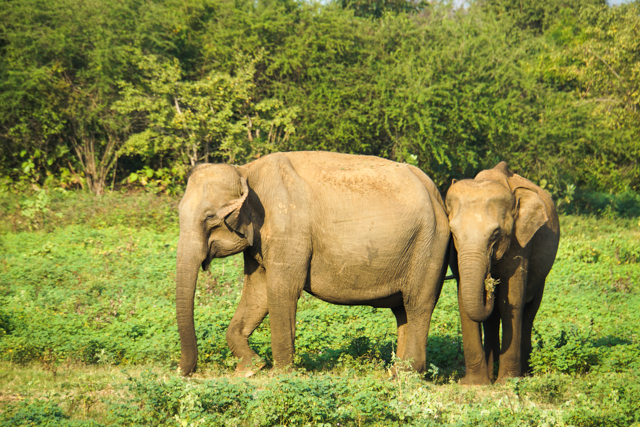
Where is `right front leg`? The width and height of the screenshot is (640, 427). right front leg is located at coordinates (235, 338).